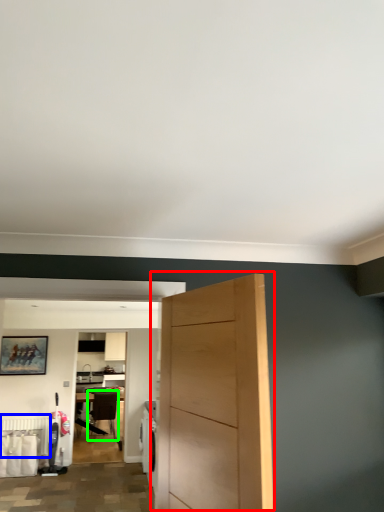
Question: Estimate the real-world distances between objects in this image. Which object is farther from door (highlighted by a red box), radiator (highlighted by a blue box) or chair (highlighted by a green box)?

Choices:
 (A) radiator
 (B) chair

Answer: (B)